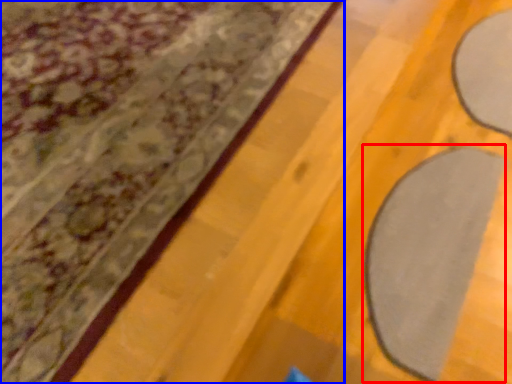
Question: Which point is further to the camera, yoga mat (highlighted by a red box) or curtain (highlighted by a blue box)?

Choices:
 (A) yoga mat
 (B) curtain

Answer: (A)